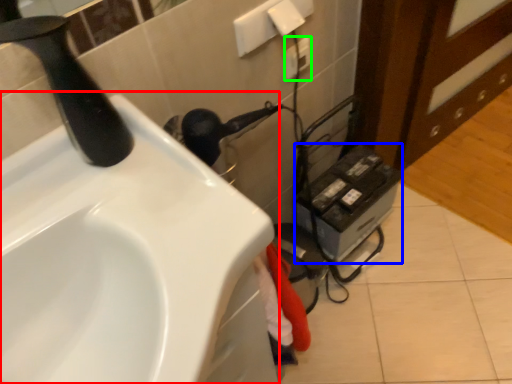
Question: Considering the real-world distances, which object is farthest from sink (highlighted by a red box)? appliance (highlighted by a blue box) or electric outlet (highlighted by a green box)?

Choices:
 (A) appliance
 (B) electric outlet

Answer: (B)